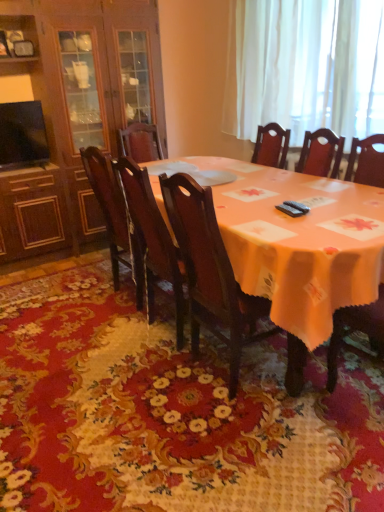
Question: Could you tell me if polished dark wood chair at center, marked as the 1th chair in a left-to-right arrangement, is facing floral carpet at center?

Choices:
 (A) no
 (B) yes

Answer: (A)

Question: Does polished dark wood chair at center, marked as the 1th chair in a left-to-right arrangement, have a smaller size compared to floral carpet at center?

Choices:
 (A) no
 (B) yes

Answer: (B)

Question: Is polished dark wood chair at center, which ranks as the 3th chair in right-to-left order, oriented away from floral carpet at center?

Choices:
 (A) yes
 (B) no

Answer: (B)

Question: Does polished dark wood chair at center, marked as the 1th chair in a left-to-right arrangement, appear on the right side of floral carpet at center?

Choices:
 (A) no
 (B) yes

Answer: (A)

Question: From a real-world perspective, is polished dark wood chair at center, marked as the 1th chair in a left-to-right arrangement, located beneath floral carpet at center?

Choices:
 (A) no
 (B) yes

Answer: (A)

Question: From the image's perspective, relative to dark wood chair at center, which is counted as the 2th chair, starting from the right, is dark wood chair at center, the 3th chair viewed from the left, above or below?

Choices:
 (A) above
 (B) below

Answer: (B)

Question: From a real-world perspective, relative to dark wood chair at center, which is counted as the 2th chair, starting from the right, is dark wood chair at center, which is counted as the first chair, starting from the right, vertically above or below?

Choices:
 (A) below
 (B) above

Answer: (B)

Question: Is dark wood chair at center, the 3th chair viewed from the left, bigger or smaller than dark wood chair at center, which ranks as the 2th chair in left-to-right order?

Choices:
 (A) big
 (B) small

Answer: (B)

Question: Is dark wood chair at center, the 3th chair viewed from the left, to the left or to the right of dark wood chair at center, which is counted as the 2th chair, starting from the right, in the image?

Choices:
 (A) right
 (B) left

Answer: (A)

Question: From their relative heights in the image, would you say polished dark wood chair at center, which ranks as the 3th chair in right-to-left order, is taller or shorter than floral carpet at center?

Choices:
 (A) short
 (B) tall

Answer: (B)

Question: Is polished dark wood chair at center, which ranks as the 3th chair in right-to-left order, wider or thinner than floral carpet at center?

Choices:
 (A) thin
 (B) wide

Answer: (A)

Question: Based on their positions, is polished dark wood chair at center, which ranks as the 3th chair in right-to-left order, located to the left or right of floral carpet at center?

Choices:
 (A) left
 (B) right

Answer: (A)

Question: In terms of size, does polished dark wood chair at center, which ranks as the 3th chair in right-to-left order, appear bigger or smaller than floral carpet at center?

Choices:
 (A) small
 (B) big

Answer: (A)

Question: Relative to dark wood chair at center, which is counted as the 2th chair, starting from the right, is white sheer curtain at upper right in front or behind?

Choices:
 (A) behind
 (B) front

Answer: (A)

Question: Is white sheer curtain at upper right inside or outside of dark wood chair at center, which ranks as the 2th chair in left-to-right order?

Choices:
 (A) inside
 (B) outside

Answer: (B)